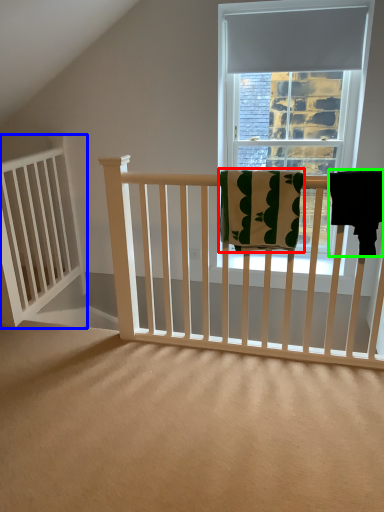
Question: Which is nearer to the beach towel (highlighted by a red box)? balustrade (highlighted by a blue box) or beach towel (highlighted by a green box).

Choices:
 (A) balustrade
 (B) beach towel

Answer: (B)